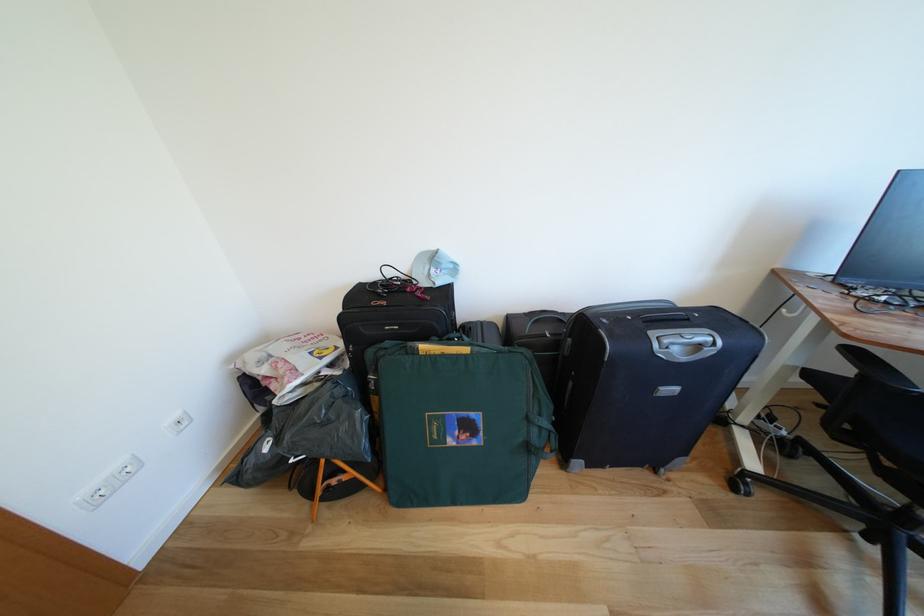
What do you see at coordinates (541, 437) in the screenshot? The height and width of the screenshot is (616, 924). I see `the green bag handle` at bounding box center [541, 437].